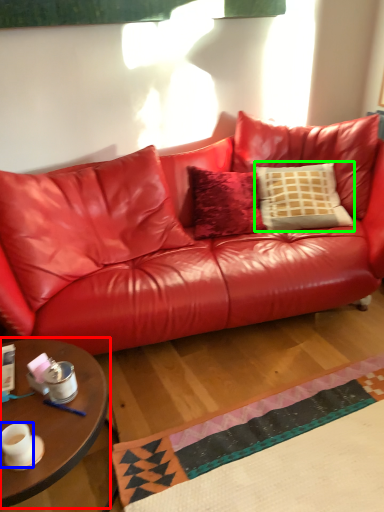
Question: Which is farther away from coffee table (highlighted by a red box)? coffee cup (highlighted by a blue box) or pillow (highlighted by a green box)?

Choices:
 (A) coffee cup
 (B) pillow

Answer: (B)